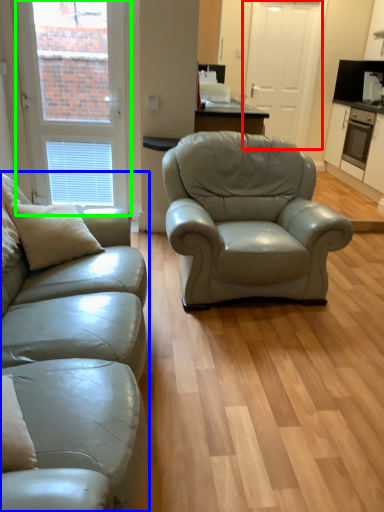
Question: Which is farther away from screen door (highlighted by a red box)? studio couch (highlighted by a blue box) or window (highlighted by a green box)?

Choices:
 (A) studio couch
 (B) window

Answer: (A)